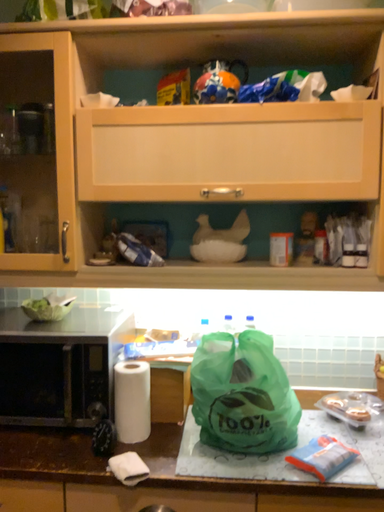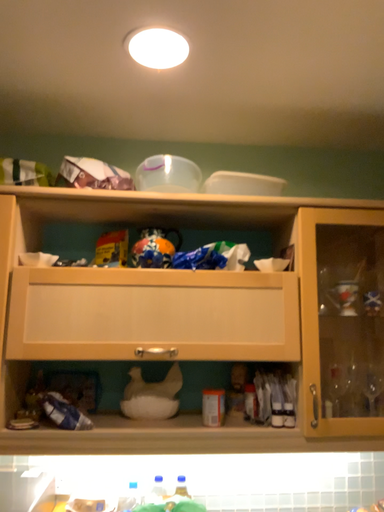
Question: How did the camera likely rotate when shooting the video?

Choices:
 (A) rotated upward
 (B) rotated downward

Answer: (A)